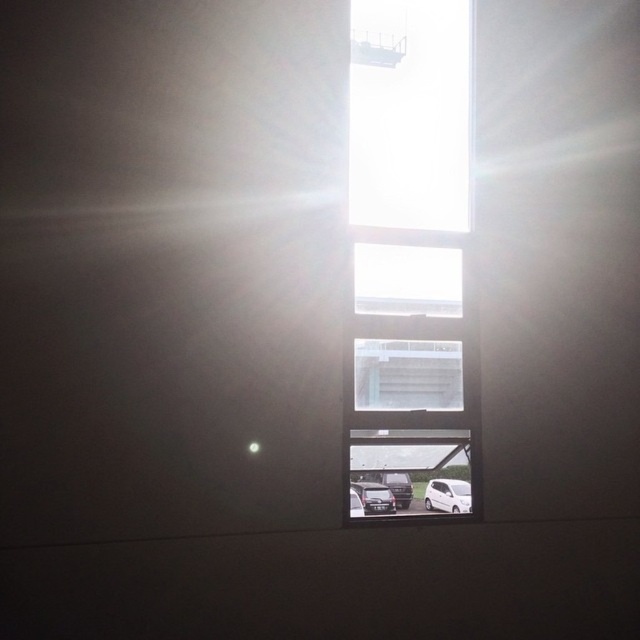
You are standing inside a building looking through the window. You notice two points marked on the window glass at coordinates point (456, 509) and point (376, 490). Which point is closer to you?

Point (456, 509) is further to the viewer than point (376, 490), so the point closer to you is point (376, 490).

You are a delivery driver who needs to park your vehicle between the white matte van at lower center and the shiny silver car at bottom center. Given that your vehicle is 2 meters wide, can you fit your vehicle between them?

The white matte van at lower center has a lesser width compared to the shiny silver car at bottom center, but the exact distance between them isn not provided. Therefore, it is impossible to determine if your vehicle can fit without additional information.

You are standing inside a building and looking through the transparent glass window at center. You see the white matte van at lower center outside. Can you determine if the van is to the left or right side of the window from your perspective?

The transparent glass window at center is positioned on the left side of white matte van at lower center, so from your perspective inside the building, the van is to the right side of the window.